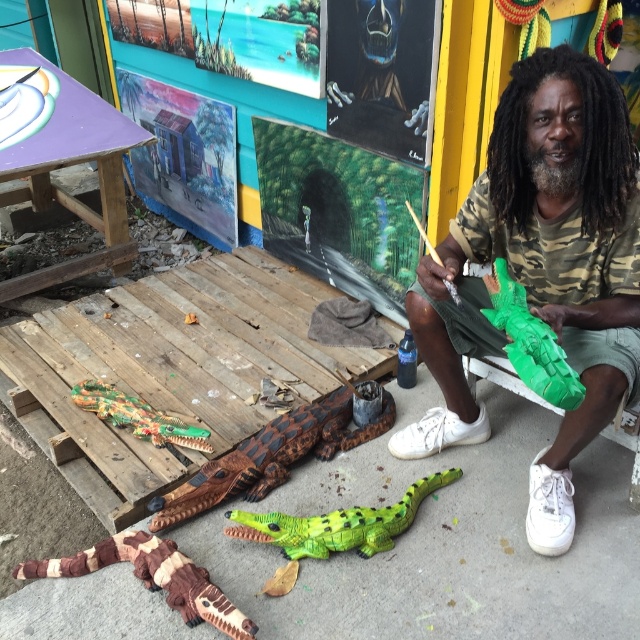
In the scene shown: You are an art student observing the scene. You need to choose between the green plastic lizard at lower center and the green matte plastic crocodile at center for a display. Which one is shorter?

The green plastic lizard at lower center is shorter than the green matte plastic crocodile at center.

From the picture: You are standing in the artistic outdoor area where the man is working with crocodile sculptures. You need to locate the green plastic lizard at lower center. What are its coordinates?

The green plastic lizard at lower center is located at coordinates point (x=337, y=524).